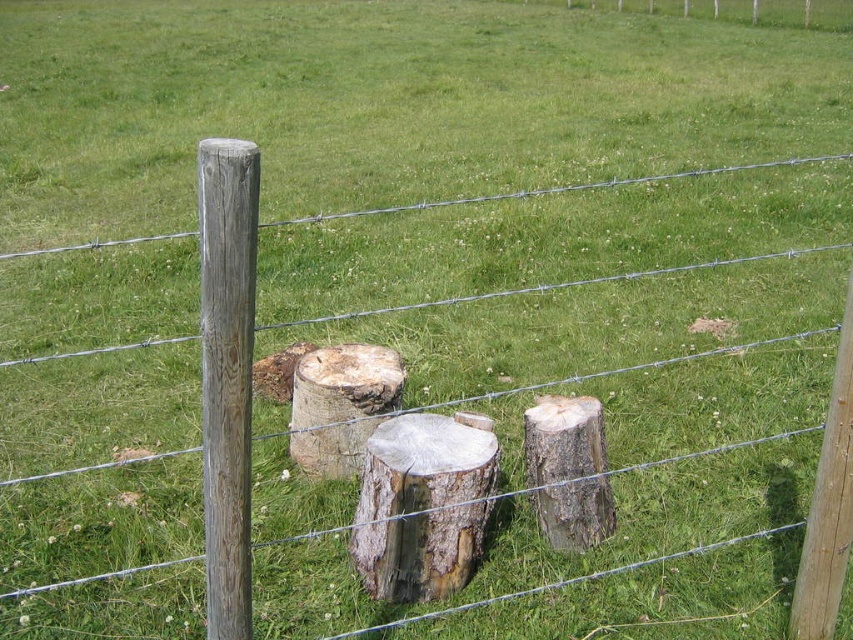
Does brown wood post at left come in front of smooth brown stump at center?

Yes, brown wood post at left is in front of smooth brown stump at center.

Is brown wood post at left positioned at the back of smooth brown stump at center?

No, brown wood post at left is in front of smooth brown stump at center.

Between point (244, 419) and point (399, 416), which one is positioned behind?

The point (399, 416) is behind.

Locate an element on the screen. brown wood post at left is located at coordinates (227, 372).

Does natural wood stump at center appear on the right side of rough bark stump at center?

Incorrect, natural wood stump at center is not on the right side of rough bark stump at center.

Between point (294, 392) and point (544, 444), which one is positioned behind?

The point (294, 392) is behind.

You are a GUI agent. You are given a task and a screenshot of the screen. Output one action in this format:
    pyautogui.click(x=<x>, y=<y>)
    Task: Click on the natural wood stump at center
    
    Given the screenshot: What is the action you would take?
    pyautogui.click(x=340, y=404)

Can you confirm if brown wood post at left is shorter than natural wood stump at center?

Incorrect, brown wood post at left's height does not fall short of natural wood stump at center's.

Identify the location of brown wood post at left. Image resolution: width=853 pixels, height=640 pixels. [227, 372].